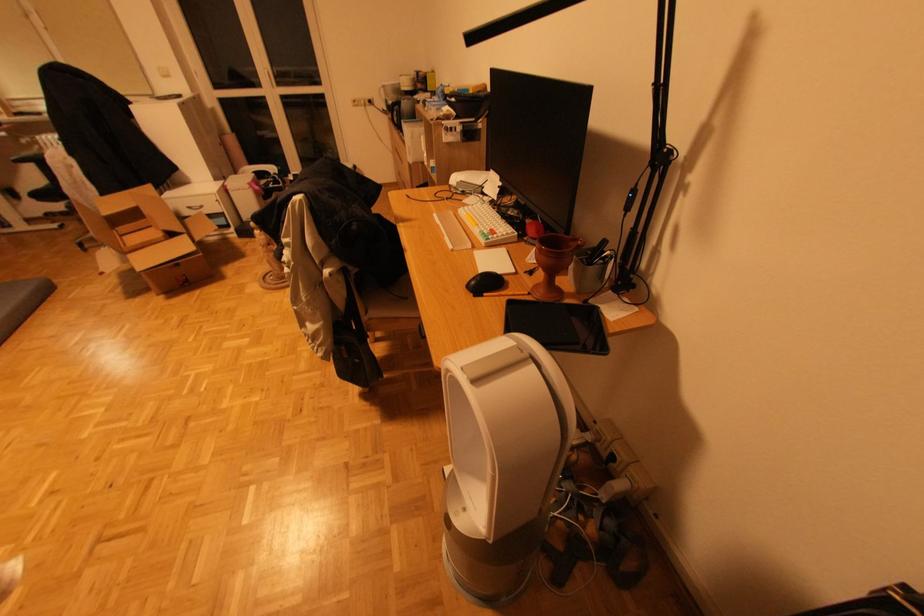
Which object does [553,262] point to?

It corresponds to the wooden goblet in the image.